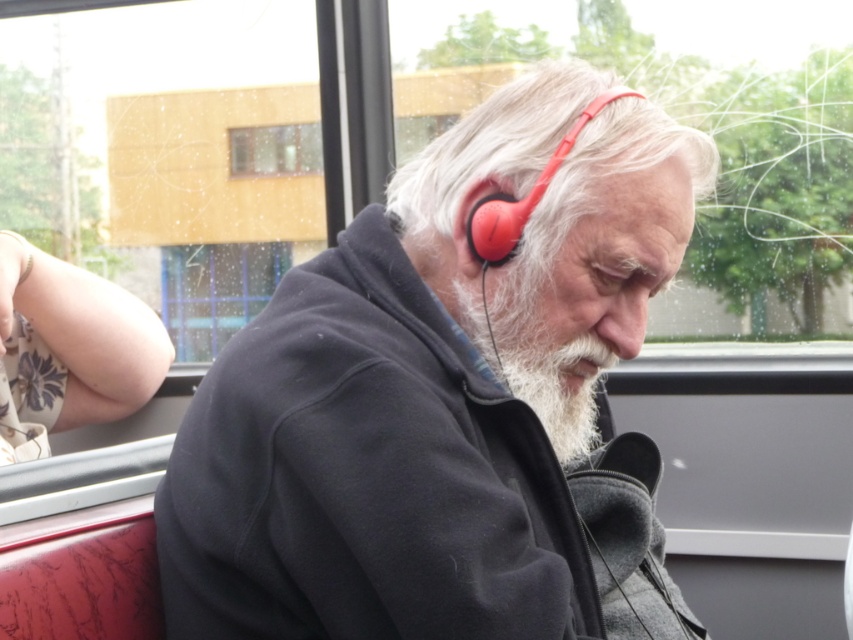
This screenshot has width=853, height=640. What do you see at coordinates (495, 141) in the screenshot? I see `white matte hair at center` at bounding box center [495, 141].

Between white matte hair at center and clear glass window at upper center, which one appears on the left side from the viewer's perspective?

From the viewer's perspective, clear glass window at upper center appears more on the left side.

Locate an element on the screen. The height and width of the screenshot is (640, 853). white matte hair at center is located at coordinates (495, 141).

Is matte black headphones at center taller than white matte hair at center?

Indeed, matte black headphones at center has a greater height compared to white matte hair at center.

Is matte black headphones at center positioned before white matte hair at center?

That is True.

Is point (273, 525) positioned before point (410, 202)?

Yes, point (273, 525) is closer to viewer.

You are a GUI agent. You are given a task and a screenshot of the screen. Output one action in this format:
    pyautogui.click(x=<x>, y=<y>)
    Task: Click on the matte black headphones at center
    This screenshot has width=853, height=640.
    Given the screenshot: What is the action you would take?
    pyautogui.click(x=442, y=400)

Who is positioned more to the left, matte red earphone at upper center or clear glass window at upper center?

Positioned to the left is clear glass window at upper center.

Between matte red earphone at upper center and clear glass window at upper center, which one has more height?

Standing taller between the two is matte red earphone at upper center.

In order to click on matte red earphone at upper center in this screenshot , I will do `click(523, 196)`.